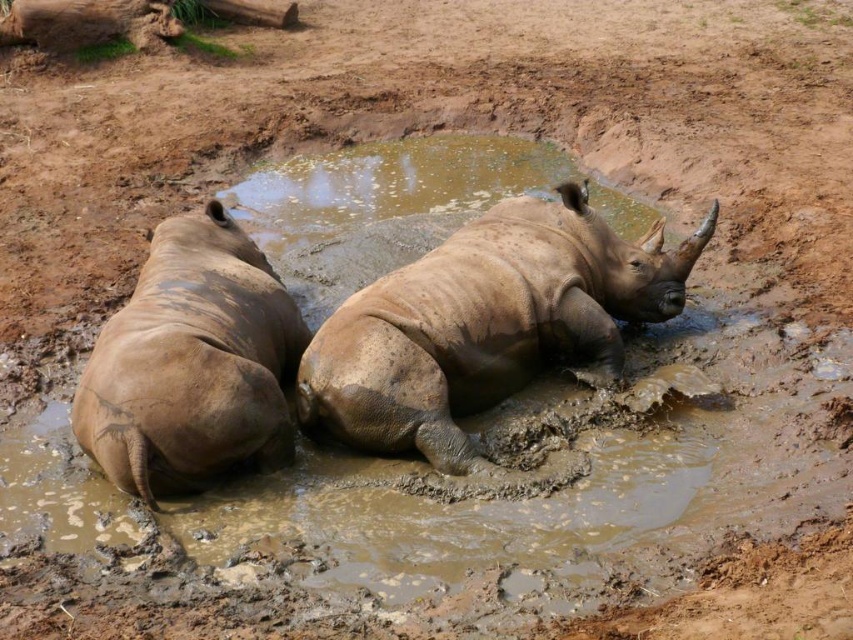
Between muddy skin rhino at center and muddy skin rhino at left, which one has more height?

With more height is muddy skin rhino at center.

What do you see at coordinates (486, 324) in the screenshot? This screenshot has width=853, height=640. I see `muddy skin rhino at center` at bounding box center [486, 324].

Who is more distant from viewer, [579,275] or [213,385]?

The point [579,275] is more distant.

This screenshot has height=640, width=853. Find the location of `muddy skin rhino at center`. muddy skin rhino at center is located at coordinates (486, 324).